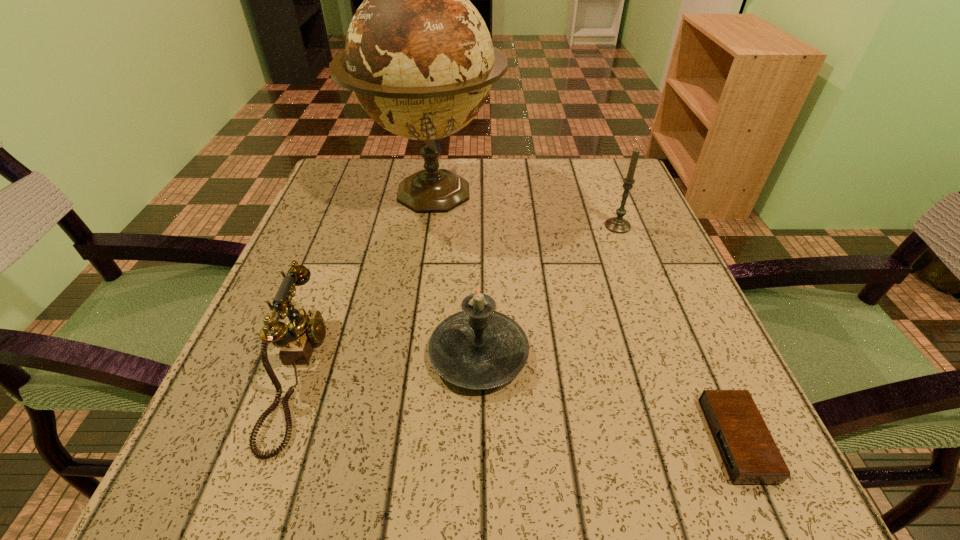
Locate an element on the screen. free space at the far right corner is located at coordinates (576, 163).

Where is `vacant space at the near right corner`? vacant space at the near right corner is located at coordinates (681, 456).

In order to click on free spot between the second shortest object and the right candle in this screenshot , I will do `click(457, 299)`.

Locate an element on the screen. The image size is (960, 540). vacant space in between the globe and the shortest object is located at coordinates tap(584, 316).

Image resolution: width=960 pixels, height=540 pixels. Identify the location of vacant area that lies between the alarm clock and the right candle. (677, 333).

I want to click on vacant region between the left candle and the second shortest object, so click(x=388, y=363).

Locate an element on the screen. free spot between the alarm clock and the right candle is located at coordinates (677, 333).

Find the location of a particular element. vacant point located between the alarm clock and the nearer candle is located at coordinates (608, 397).

Locate an element on the screen. This screenshot has width=960, height=540. vacant point located between the tallest object and the shorter candle is located at coordinates (455, 274).

Image resolution: width=960 pixels, height=540 pixels. What are the coordinates of `free space that is in between the shorter candle and the farther candle` in the screenshot? It's located at (548, 290).